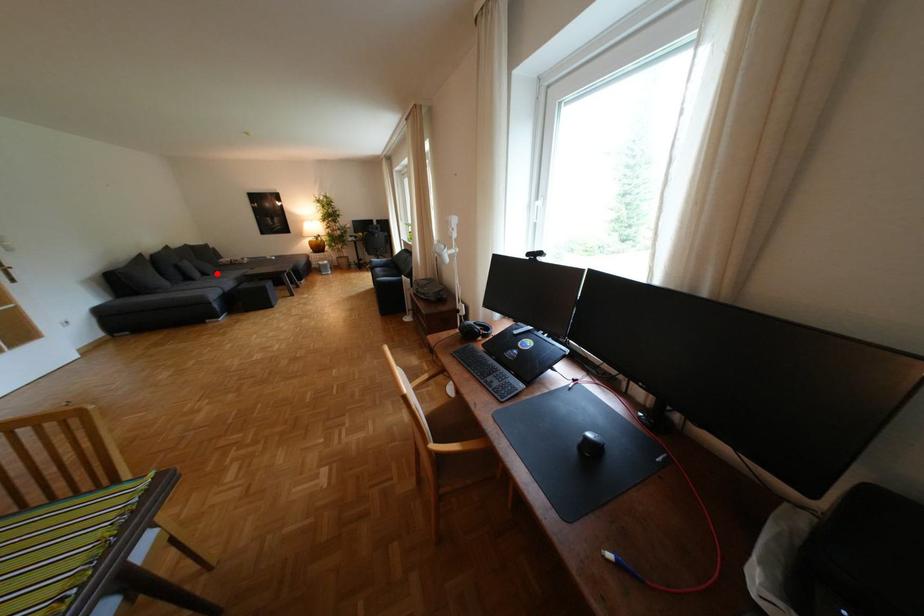
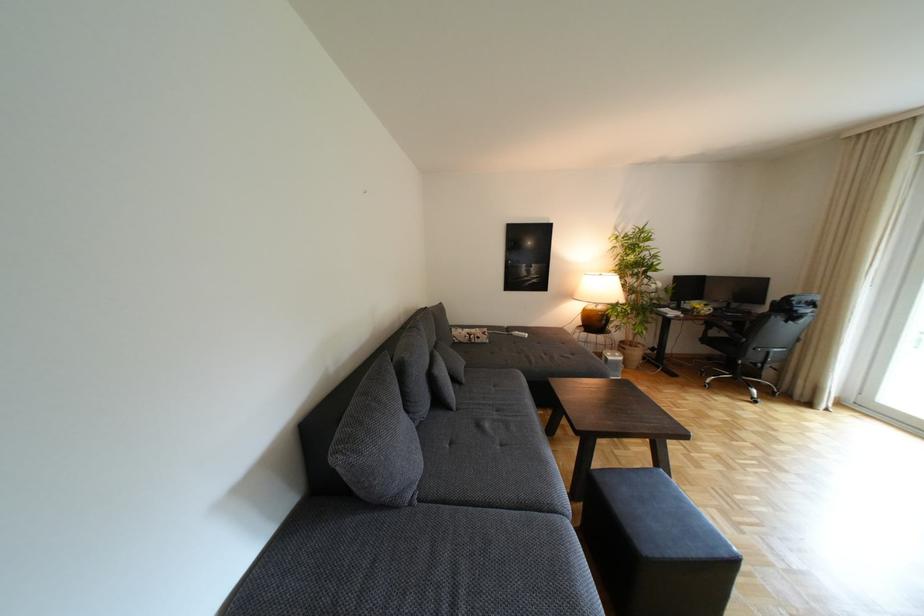
Where in the second image is the point corresponding to the highlighted location from the first image?

(468, 379)